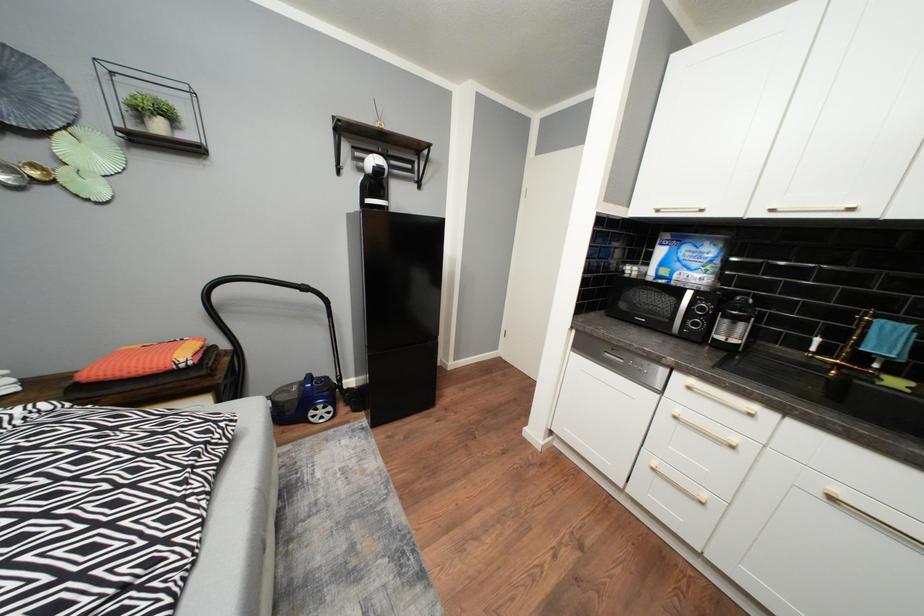
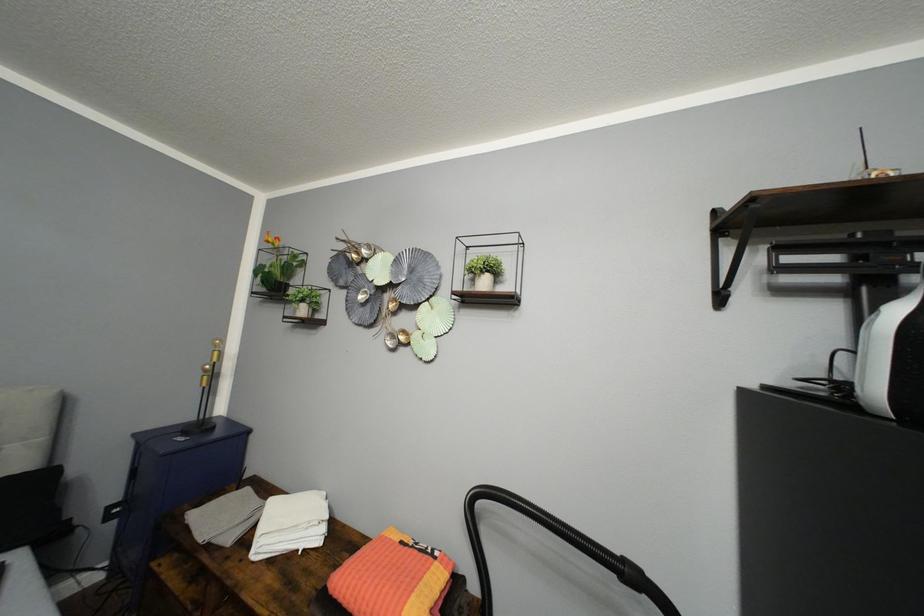
The images are taken continuously from a first-person perspective. In which direction is your viewpoint rotating?

The camera's rotation is toward left-up.